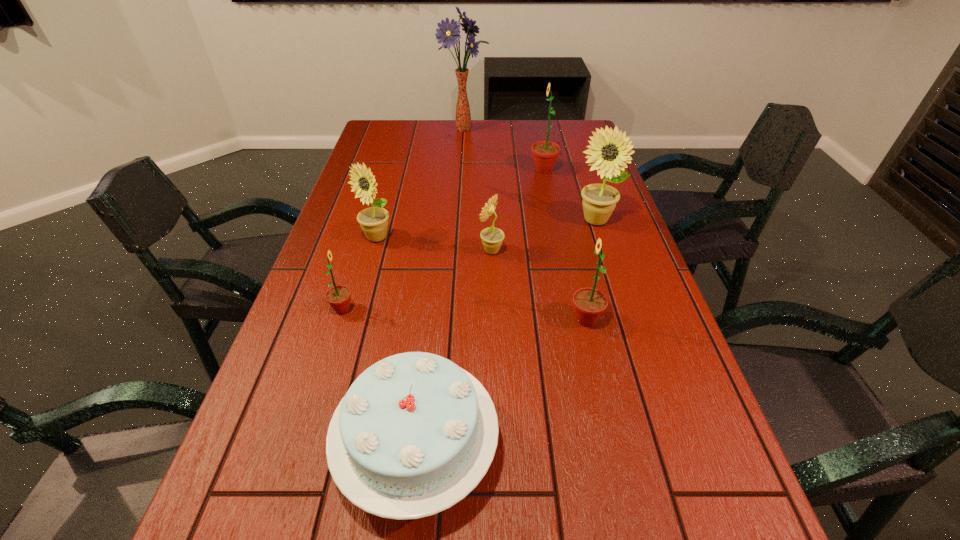
Locate an element on the screen. the nearest object is located at coordinates (415, 433).

You are a GUI agent. You are given a task and a screenshot of the screen. Output one action in this format:
    pyautogui.click(x=<x>, y=<y>)
    Task: Click on the blue birthday cake
    
    Given the screenshot: What is the action you would take?
    pyautogui.click(x=415, y=433)

I want to click on free space located on the front of the tallest object, so click(x=464, y=156).

Locate an element on the screen. The height and width of the screenshot is (540, 960). free space located on the face of the farthest sunflower is located at coordinates (461, 170).

Locate an element on the screen. free spot located on the face of the farthest sunflower is located at coordinates (495, 170).

Locate an element on the screen. vacant space located on the face of the farthest sunflower is located at coordinates (487, 170).

Where is `free space located 0.400m on the face of the biggest yellow sunflower`? The width and height of the screenshot is (960, 540). free space located 0.400m on the face of the biggest yellow sunflower is located at coordinates (634, 341).

Where is `vacant space situated on the face of the second smallest green sunflower`? vacant space situated on the face of the second smallest green sunflower is located at coordinates (543, 320).

Where is `free space located 0.280m on the face of the second smallest green sunflower`? free space located 0.280m on the face of the second smallest green sunflower is located at coordinates click(x=449, y=320).

Where is `vacant space situated on the face of the second smallest green sunflower`? The height and width of the screenshot is (540, 960). vacant space situated on the face of the second smallest green sunflower is located at coordinates (416, 320).